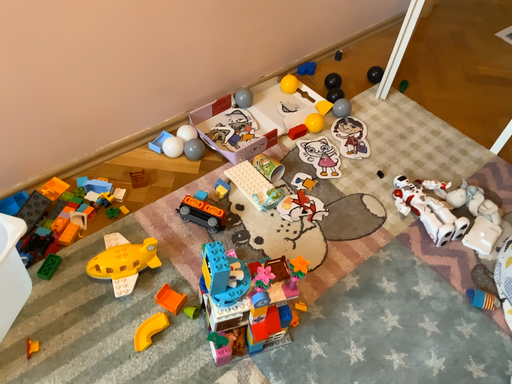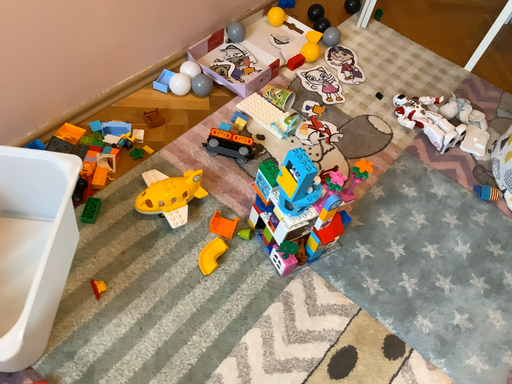
Question: Which way did the camera rotate in the video?

Choices:
 (A) rotated left
 (B) rotated right

Answer: (B)